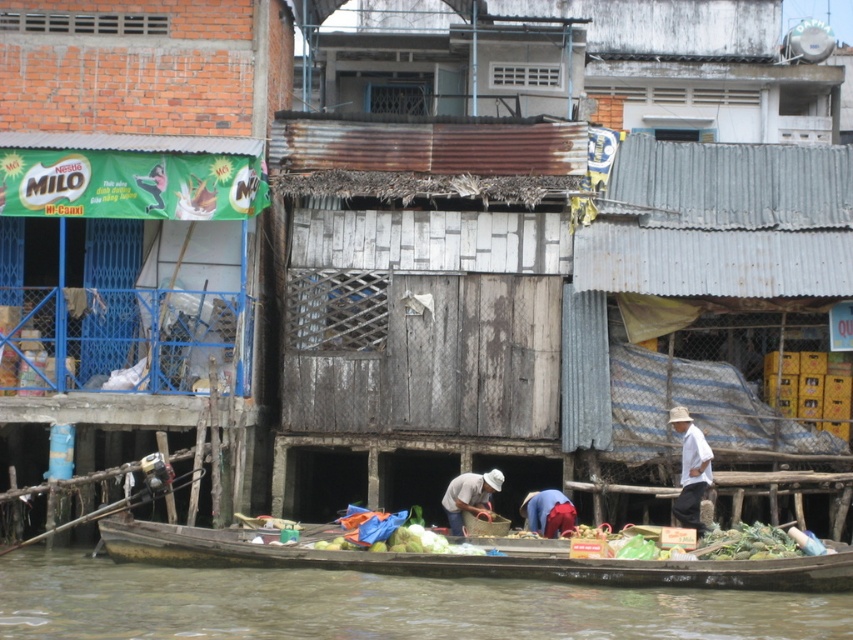
You are a customer looking to buy vegetables from the boat. The wooden canoe at lower center and the red fabric at lower center are both on the boat. Which object is closer to the water surface?

A: The wooden canoe at lower center is below red fabric at lower center, so it is closer to the water surface.

Consider the image. You are a delivery person who needs to place a 3.0 meter long package between the wooden canoe at lower center and the red fabric at lower center. Is there enough space to fit the package between them?

The wooden canoe at lower center and red fabric at lower center are 3.10 meters apart from each other, so yes, the 3.0 meter long package can fit between them since the distance is slightly larger than the package.

You are standing on the riverside and see the wooden canoe at lower center and the red fabric at lower center. Which object is nearer to you?

The wooden canoe at lower center is closer to the viewer than the red fabric at lower center, so the wooden canoe at lower center is nearer to you.